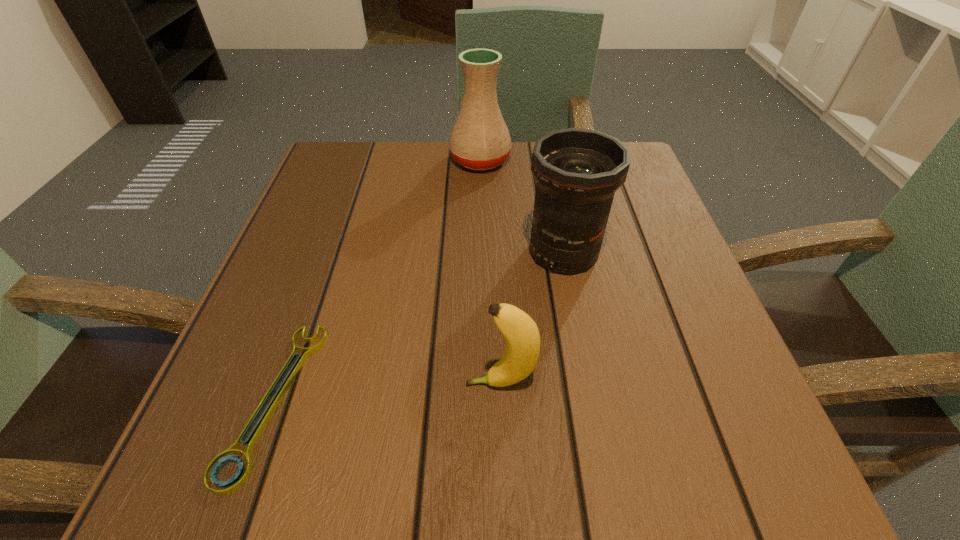
This screenshot has height=540, width=960. In the image, there is a desktop. Find the location of `vacant space at the right edge`. vacant space at the right edge is located at coordinates (604, 268).

In the image, there is a desktop. Where is `vacant space at the far left corner`? vacant space at the far left corner is located at coordinates (354, 159).

You are a GUI agent. You are given a task and a screenshot of the screen. Output one action in this format:
    pyautogui.click(x=<x>, y=<y>)
    Task: Click on the free space between the third tallest object and the farthest object
    The image size is (960, 540).
    Given the screenshot: What is the action you would take?
    pyautogui.click(x=491, y=272)

You are a GUI agent. You are given a task and a screenshot of the screen. Output one action in this format:
    pyautogui.click(x=<x>, y=<y>)
    Task: Click on the vacant area that lies between the farthest object and the second farthest object
    The width and height of the screenshot is (960, 540).
    Given the screenshot: What is the action you would take?
    pyautogui.click(x=522, y=206)

Find the location of `vacant area that lies between the shortest object and the telephoto lens`. vacant area that lies between the shortest object and the telephoto lens is located at coordinates (419, 326).

You are a GUI agent. You are given a task and a screenshot of the screen. Output one action in this format:
    pyautogui.click(x=<x>, y=<y>)
    Task: Click on the free space between the second farthest object and the pottery
    Image resolution: width=960 pixels, height=540 pixels.
    Given the screenshot: What is the action you would take?
    [522, 206]

At what (x,y) coordinates should I click in order to perform the action: click on unoccupied position between the banana and the shortest object. Please return your answer as a coordinate pair (x, y). Image resolution: width=960 pixels, height=540 pixels. Looking at the image, I should click on (387, 392).

Locate an element on the screen. free spot between the telephoto lens and the farthest object is located at coordinates (522, 206).

The height and width of the screenshot is (540, 960). I want to click on free spot between the second shortest object and the telephoto lens, so click(532, 318).

This screenshot has height=540, width=960. Find the location of `vacant space that is in between the banana and the shortest object`. vacant space that is in between the banana and the shortest object is located at coordinates (387, 392).